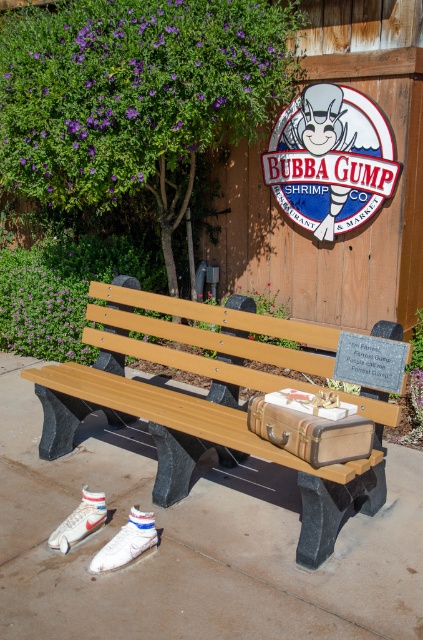
Is wooden bench at center wider than white leather shoe at lower left?

Indeed, wooden bench at center has a greater width compared to white leather shoe at lower left.

Find the location of a particular element. The height and width of the screenshot is (640, 423). wooden bench at center is located at coordinates tap(233, 403).

Measure the distance between wooden bench at center and camera.

wooden bench at center is 8.61 feet from camera.

Between wooden bench at center and wooden signboard at upper center, which one appears on the left side from the viewer's perspective?

Positioned to the left is wooden bench at center.

The width and height of the screenshot is (423, 640). I want to click on wooden bench at center, so [233, 403].

This screenshot has width=423, height=640. I want to click on wooden bench at center, so click(x=233, y=403).

Measure the distance between point (318, 120) and camera.

Point (318, 120) is 4.92 meters away from camera.

Between point (310, 205) and point (93, 529), which one is positioned behind?

Positioned behind is point (310, 205).

At what (x,y) coordinates should I click in order to perform the action: click on wooden signboard at upper center. Please return your answer as a coordinate pair (x, y). Looking at the image, I should click on (329, 160).